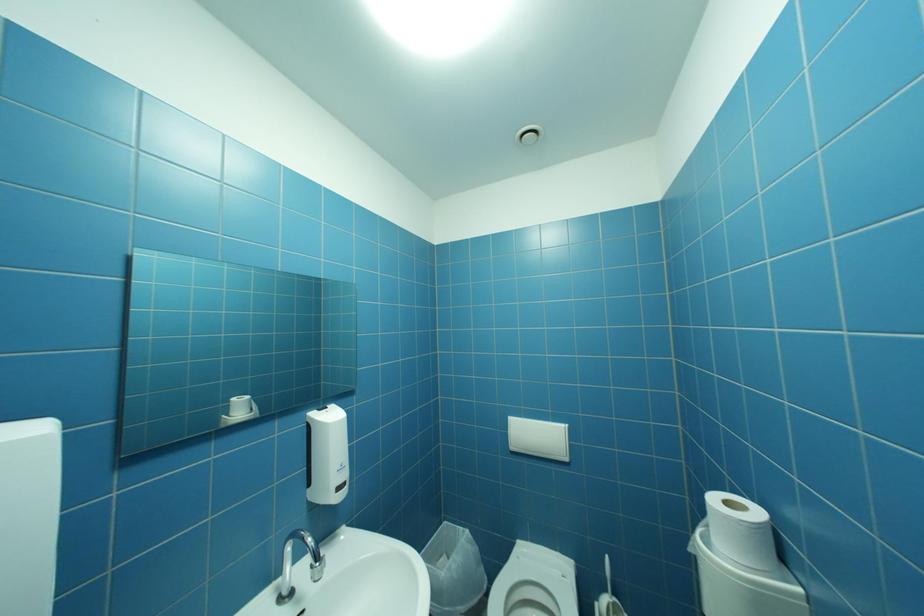
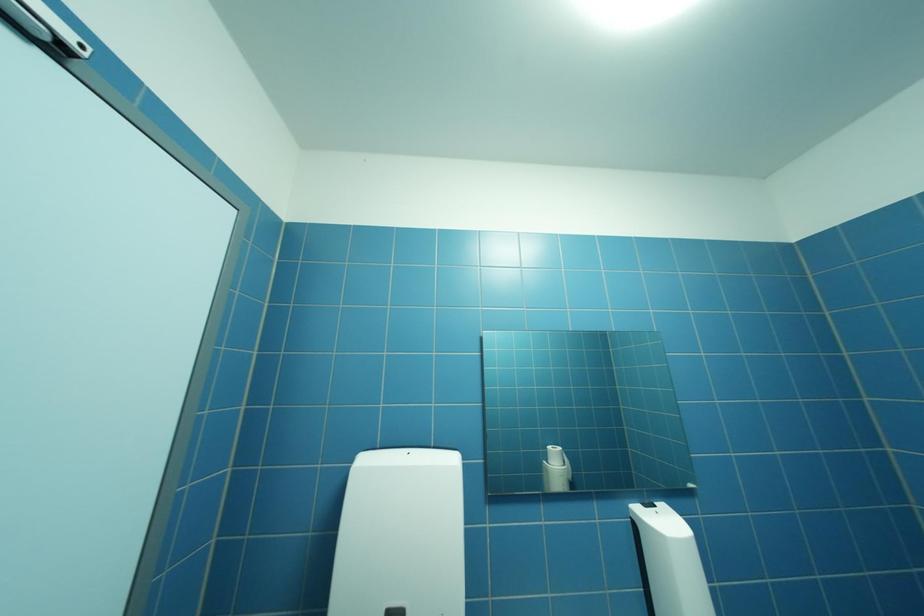
Question: The images are taken continuously from a first-person perspective. In which direction is your viewpoint rotating?

Choices:
 (A) Left
 (B) Right
 (C) Up
 (D) Down

Answer: (A)